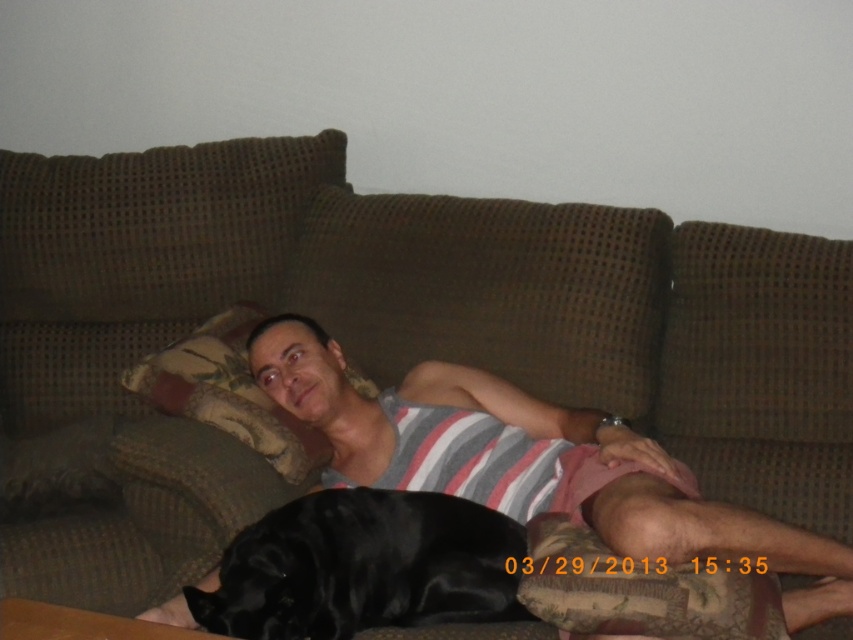
You are designing a new fashion line and want to incorporate the striped fabric tank top at center and the brown textured pillow at upper left into an outfit. Which item should you place higher in the design to maintain visual balance?

The striped fabric tank top at center is taller than the brown textured pillow at upper left, so placing the striped fabric tank top at center higher in the design will help maintain visual balance by balancing their heights.

You are a photographer setting up a shoot in this living room. You want to place a 12 inch wide decorative plate between the shiny black dog at lower left and the brown textured pillow at upper left. Will the plate fit without overlapping either object?

The distance between the shiny black dog at lower left and the brown textured pillow at upper left is 15.85 inches. Since the plate is 12 inches wide, there is enough space to place it between them without overlapping either object.